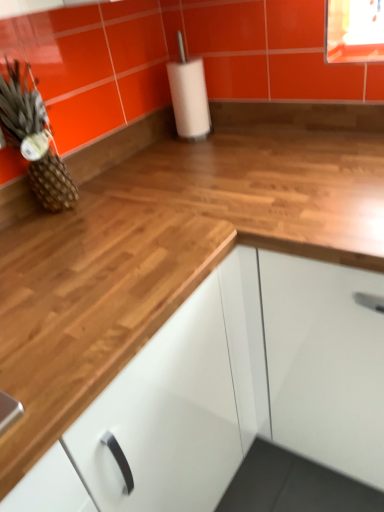
What do you see at coordinates (35, 141) in the screenshot? The image size is (384, 512). I see `brown textured pineapple at left` at bounding box center [35, 141].

This screenshot has height=512, width=384. I want to click on brown textured pineapple at left, so click(35, 141).

Measure the distance between brown textured pineapple at left and camera.

The distance of brown textured pineapple at left from camera is 38.78 inches.

Locate an element on the screen. white glossy cabinet at center is located at coordinates (231, 391).

The width and height of the screenshot is (384, 512). Describe the element at coordinates (231, 391) in the screenshot. I see `white glossy cabinet at center` at that location.

Locate an element on the screen. The image size is (384, 512). brown textured pineapple at left is located at coordinates (35, 141).

From the picture: Which is more to the right, white glossy cabinet at center or brown textured pineapple at left?

From the viewer's perspective, white glossy cabinet at center appears more on the right side.

Is white glossy cabinet at center further to the viewer compared to brown textured pineapple at left?

No.

Considering the points (290, 364) and (4, 105), which point is behind, point (290, 364) or point (4, 105)?

Point (290, 364)

From the image's perspective, which one is positioned higher, white glossy cabinet at center or brown textured pineapple at left?

brown textured pineapple at left, from the image's perspective.

From a real-world perspective, which object stands above the other?

brown textured pineapple at left.

Which of these two, white glossy cabinet at center or brown textured pineapple at left, is thinner?

brown textured pineapple at left.

Does white glossy cabinet at center have a greater height compared to brown textured pineapple at left?

Yes.

Is white glossy cabinet at center bigger than brown textured pineapple at left?

Correct, white glossy cabinet at center is larger in size than brown textured pineapple at left.

Is brown textured pineapple at left a part of white glossy cabinet at center?

No.

Would you consider white glossy cabinet at center to be distant from brown textured pineapple at left?

No, white glossy cabinet at center is not far away from brown textured pineapple at left.

Is white glossy cabinet at center aimed at brown textured pineapple at left?

No, white glossy cabinet at center is not turned towards brown textured pineapple at left.

How distant is white glossy cabinet at center from brown textured pineapple at left?

white glossy cabinet at center and brown textured pineapple at left are 25.87 inches apart.

At what (x,y) coordinates should I click in order to perform the action: click on pineapple behind the white glossy cabinet at center. Please return your answer as a coordinate pair (x, y). This screenshot has height=512, width=384. Looking at the image, I should click on (35, 141).

Can you confirm if brown textured pineapple at left is positioned to the left of white glossy cabinet at center?

Indeed, brown textured pineapple at left is positioned on the left side of white glossy cabinet at center.

In the image, is brown textured pineapple at left positioned in front of or behind white glossy cabinet at center?

brown textured pineapple at left is behind white glossy cabinet at center.

Considering the positions of points (34, 101) and (274, 370), is point (34, 101) farther from camera compared to point (274, 370)?

No, (34, 101) is in front of (274, 370).

From the image's perspective, who appears lower, brown textured pineapple at left or white glossy cabinet at center?

white glossy cabinet at center appears lower in the image.

From a real-world perspective, between brown textured pineapple at left and white glossy cabinet at center, who is vertically lower?

In real-world perspective, white glossy cabinet at center is lower.

Looking at their sizes, would you say brown textured pineapple at left is wider or thinner than white glossy cabinet at center?

Considering their sizes, brown textured pineapple at left looks slimmer than white glossy cabinet at center.

From the picture: Between brown textured pineapple at left and white glossy cabinet at center, which one has more height?

white glossy cabinet at center is taller.

Who is smaller, brown textured pineapple at left or white glossy cabinet at center?

Smaller between the two is brown textured pineapple at left.

Can we say brown textured pineapple at left lies outside white glossy cabinet at center?

Yes.

Is brown textured pineapple at left placed right next to white glossy cabinet at center?

They are not placed beside each other.

Is brown textured pineapple at left looking in the opposite direction of white glossy cabinet at center?

No, white glossy cabinet at center is not at the back of brown textured pineapple at left.

Consider the image. How far apart are brown textured pineapple at left and white glossy cabinet at center?

brown textured pineapple at left is 25.87 inches from white glossy cabinet at center.

Identify the location of pineapple that appears behind the white glossy cabinet at center. The height and width of the screenshot is (512, 384). (35, 141).

You are a GUI agent. You are given a task and a screenshot of the screen. Output one action in this format:
    pyautogui.click(x=<x>, y=<y>)
    Task: Click on the cabinetry in front of the brown textured pineapple at left
    
    Given the screenshot: What is the action you would take?
    pyautogui.click(x=231, y=391)

Locate an element on the screen. This screenshot has width=384, height=512. cabinetry lying below the brown textured pineapple at left (from the image's perspective) is located at coordinates (231, 391).